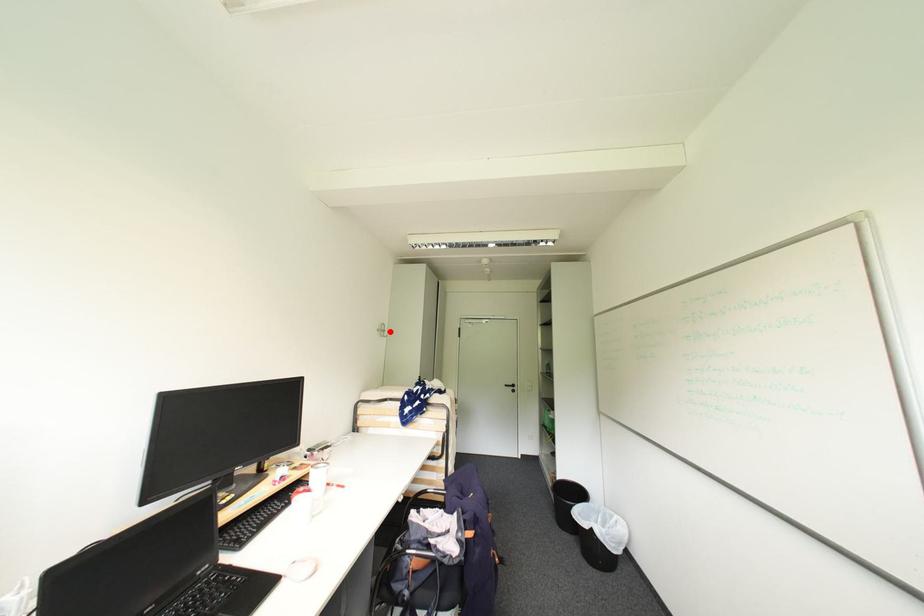
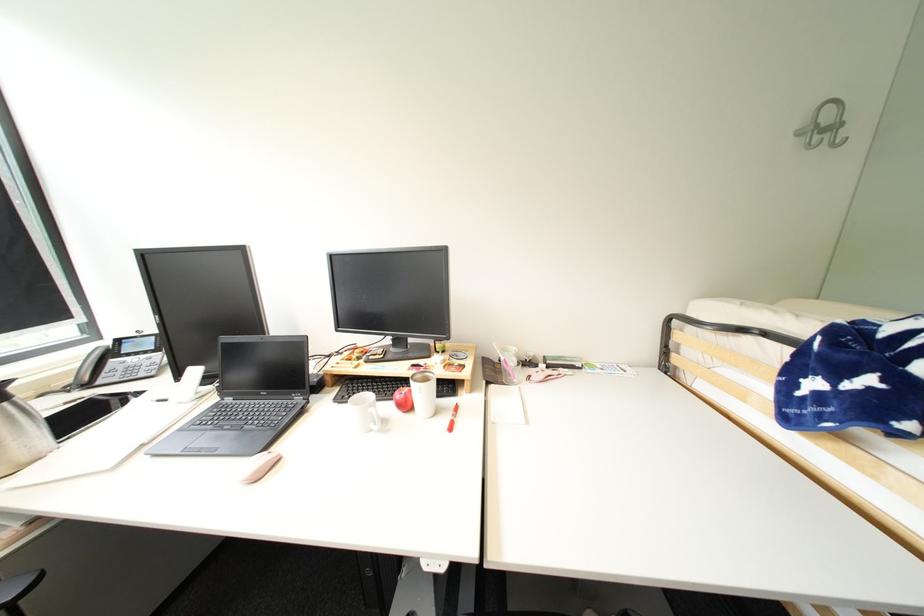
Find the pixel in the second image that matches the highlighted location in the first image.

(841, 128)